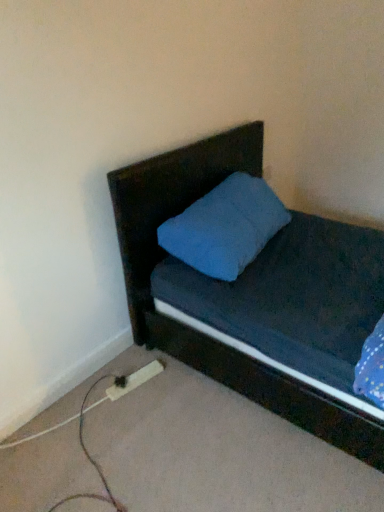
Image resolution: width=384 pixels, height=512 pixels. Identify the location of free space in front of wooden extension cord at lower left. (126, 410).